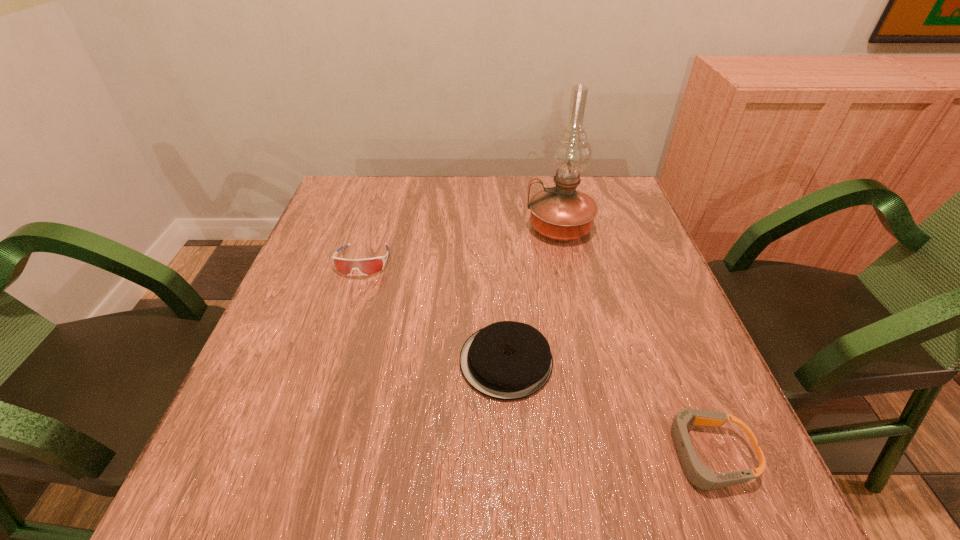
At what (x,y) coordinates should I click in order to perform the action: click on vacant space at the near edge. Please return your answer as a coordinate pair (x, y). Looking at the image, I should click on (461, 476).

Where is `vacant space at the left edge of the desktop`? This screenshot has width=960, height=540. vacant space at the left edge of the desktop is located at coordinates (257, 454).

In the image, there is a desktop. Where is `vacant space at the right edge`? The width and height of the screenshot is (960, 540). vacant space at the right edge is located at coordinates (598, 243).

The width and height of the screenshot is (960, 540). I want to click on vacant space at the far left corner of the desktop, so click(x=375, y=203).

At what (x,y) coordinates should I click in order to perform the action: click on free region at the far right corner. Please return your answer as a coordinate pair (x, y). This screenshot has height=540, width=960. Looking at the image, I should click on (590, 183).

This screenshot has width=960, height=540. What are the coordinates of `free space between the oil lamp and the taller goggles` in the screenshot? It's located at (462, 244).

This screenshot has width=960, height=540. What are the coordinates of `free area in between the second nearest object and the nearest object` in the screenshot? It's located at tap(607, 408).

Locate an element on the screen. This screenshot has height=540, width=960. vacant space that's between the left goggles and the oil lamp is located at coordinates (462, 244).

You are a GUI agent. You are given a task and a screenshot of the screen. Output one action in this format:
    pyautogui.click(x=<x>, y=<y>)
    Task: Click on the free spot between the tallest object and the second nearest object
    
    Given the screenshot: What is the action you would take?
    pyautogui.click(x=533, y=294)

The image size is (960, 540). Identify the location of free space between the shortest object and the oil lamp. (634, 341).